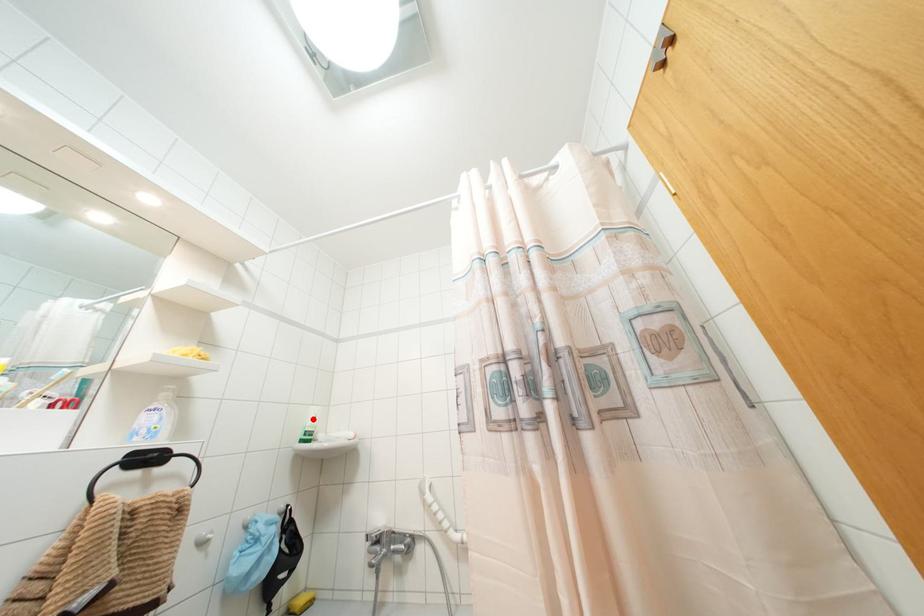
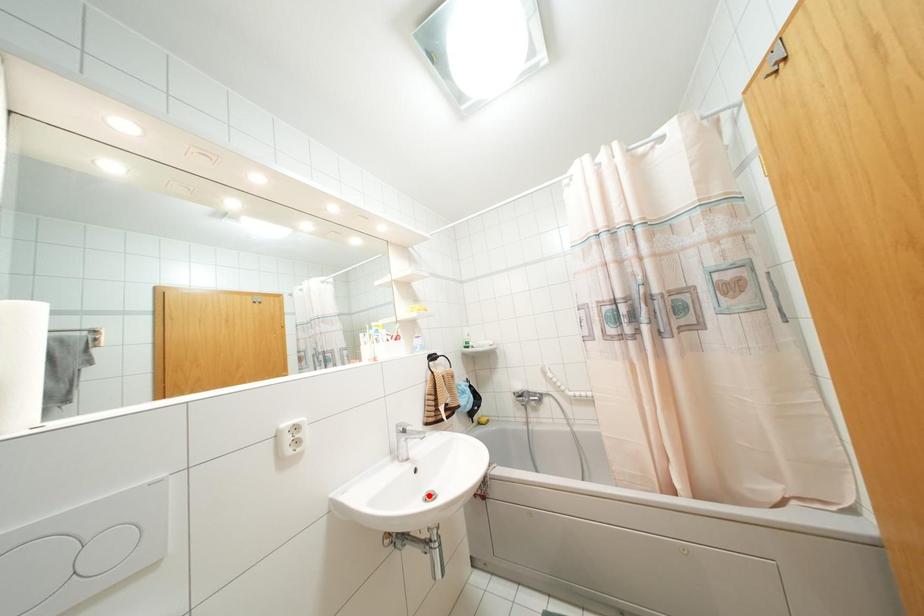
I am providing you with two images of the same scene from different viewpoints. A red point is marked on the first image and another point is marked on the second image. Are the points marked in image1 and image2 representing the same 3D position?

No